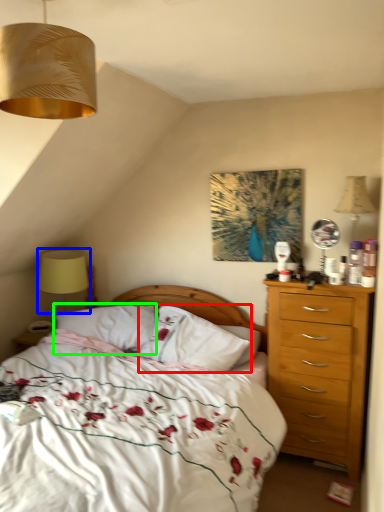
Question: Based on their relative distances, which object is nearer to pillow (highlighted by a red box)? Choose from table lamp (highlighted by a blue box) and pillow (highlighted by a green box).

Choices:
 (A) table lamp
 (B) pillow

Answer: (B)